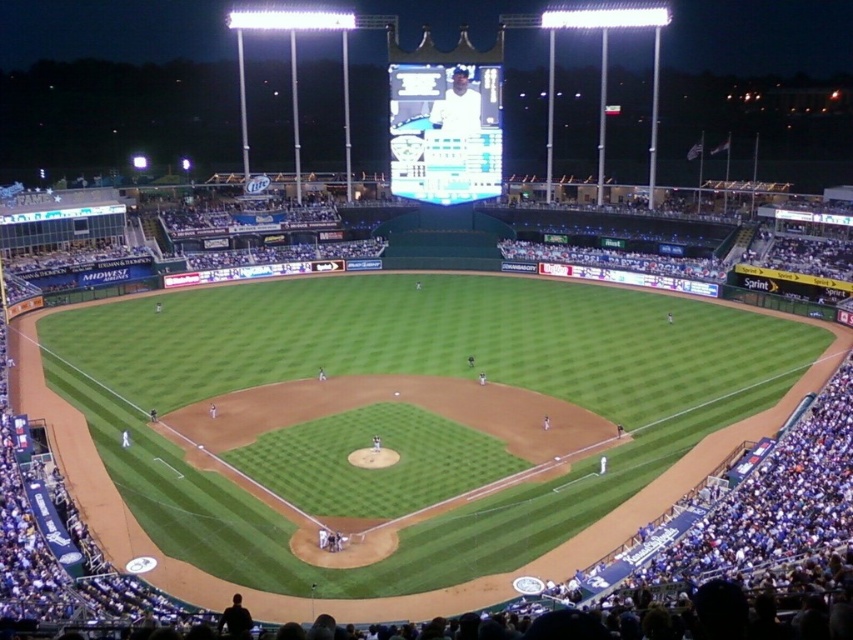
Question: Can you confirm if white glossy scoreboard at upper center is positioned below white matte uniform at upper center?

Choices:
 (A) no
 (B) yes

Answer: (B)

Question: Which point is farther to the camera?

Choices:
 (A) white glossy scoreboard at upper center
 (B) white matte uniform at upper center

Answer: (B)

Question: Is white glossy scoreboard at upper center thinner than white matte uniform at upper center?

Choices:
 (A) no
 (B) yes

Answer: (A)

Question: Among these points, which one is farthest from the camera?

Choices:
 (A) pos(456,125)
 (B) pos(407,108)

Answer: (A)

Question: Does white glossy scoreboard at upper center appear on the left side of white matte uniform at upper center?

Choices:
 (A) yes
 (B) no

Answer: (A)